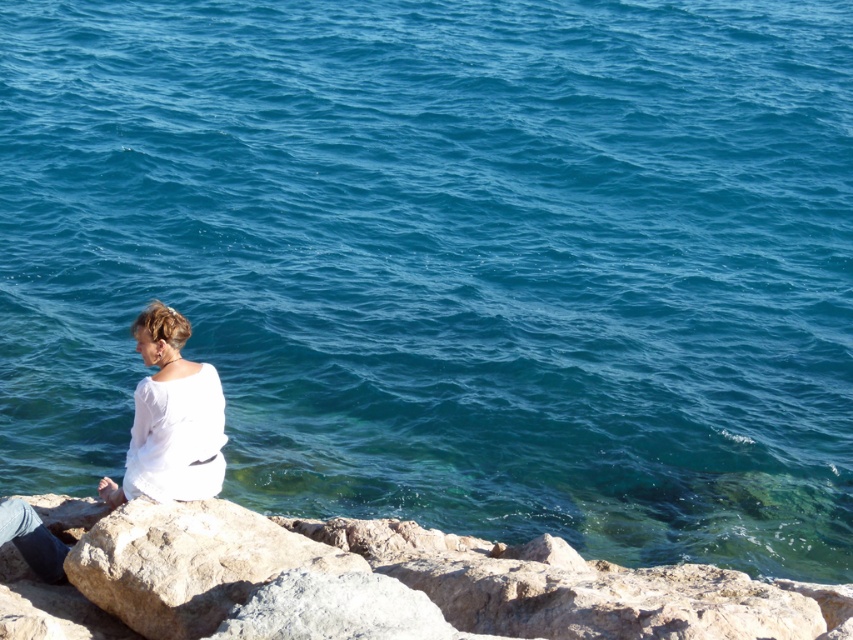
You are standing at the edge of the cliff and want to move closer to the white cotton shirt at lower left without stepping on the gray rough rock at lower left. Which direction should you move?

You should move to the left because the gray rough rock at lower left is to the right of the white cotton shirt at lower left, so moving left would avoid stepping on the rock.

You are a photographer trying to capture the white cotton shirt at lower left and the gray rough rock at lower left in the same frame. Based on their sizes, do you think you can fit both subjects into your camera viewfinder without zooming in?

The gray rough rock at lower left might be wider than the white cotton shirt at lower left, so there is a possibility that both can be captured in the same frame if the rock is wider, but this depends on the exact dimensions and positioning.